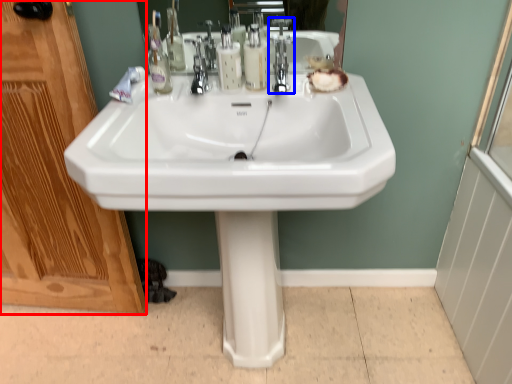
Question: Which object is further to the camera taking this photo, screen door (highlighted by a red box) or tap (highlighted by a blue box)?

Choices:
 (A) screen door
 (B) tap

Answer: (B)